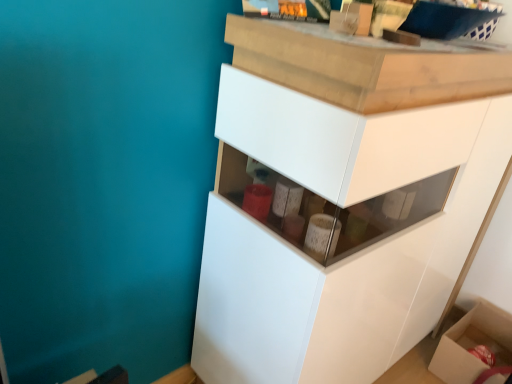
Question: Is cardboard box at lower right inside white glossy cabinet at center?

Choices:
 (A) yes
 (B) no

Answer: (B)

Question: Can you confirm if white glossy cabinet at center is bigger than cardboard box at lower right?

Choices:
 (A) no
 (B) yes

Answer: (B)

Question: Can you confirm if white glossy cabinet at center is positioned to the left of cardboard box at lower right?

Choices:
 (A) yes
 (B) no

Answer: (A)

Question: From a real-world perspective, is white glossy cabinet at center under cardboard box at lower right?

Choices:
 (A) yes
 (B) no

Answer: (B)

Question: Considering the relative sizes of white glossy cabinet at center and cardboard box at lower right in the image provided, is white glossy cabinet at center thinner than cardboard box at lower right?

Choices:
 (A) no
 (B) yes

Answer: (A)

Question: From a real-world perspective, is white glossy cabinet at center located higher than cardboard box at lower right?

Choices:
 (A) yes
 (B) no

Answer: (A)

Question: Considering the relative sizes of cardboard box at lower right and white glossy cabinet at center in the image provided, is cardboard box at lower right thinner than white glossy cabinet at center?

Choices:
 (A) no
 (B) yes

Answer: (B)

Question: Can you confirm if cardboard box at lower right is wider than white glossy cabinet at center?

Choices:
 (A) yes
 (B) no

Answer: (B)

Question: Is cardboard box at lower right closer to camera compared to white glossy cabinet at center?

Choices:
 (A) yes
 (B) no

Answer: (B)

Question: Is white glossy cabinet at center at the back of cardboard box at lower right?

Choices:
 (A) no
 (B) yes

Answer: (A)

Question: Is cardboard box at lower right aimed at white glossy cabinet at center?

Choices:
 (A) no
 (B) yes

Answer: (A)

Question: From the image's perspective, is cardboard box at lower right below white glossy cabinet at center?

Choices:
 (A) yes
 (B) no

Answer: (A)

Question: From the image's perspective, is cardboard box at lower right located above or below white glossy cabinet at center?

Choices:
 (A) above
 (B) below

Answer: (B)